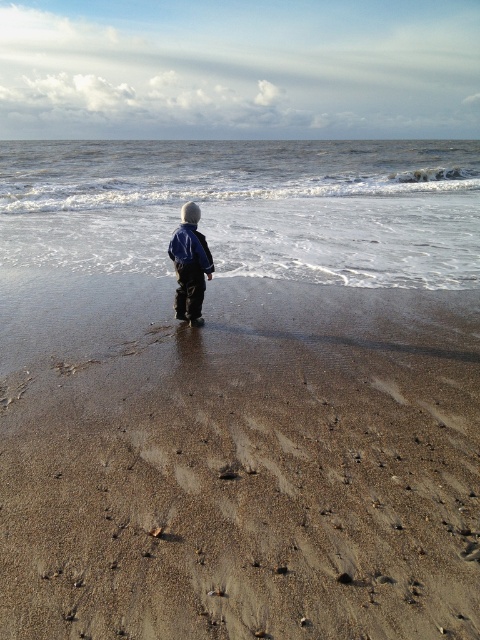
Question: Which is nearer to the white frothy water at center?

Choices:
 (A) blue denim jacket at center
 (B) brown sandy beach at center

Answer: (A)

Question: Considering the relative positions of brown sandy beach at center and white frothy water at center in the image provided, where is brown sandy beach at center located with respect to white frothy water at center?

Choices:
 (A) above
 (B) below

Answer: (B)

Question: Which object is farther from the camera taking this photo?

Choices:
 (A) brown sandy beach at center
 (B) white frothy water at center
 (C) blue denim jacket at center

Answer: (B)

Question: Is brown sandy beach at center above blue denim jacket at center?

Choices:
 (A) no
 (B) yes

Answer: (A)

Question: Considering the real-world distances, which object is farthest from the brown sandy beach at center?

Choices:
 (A) blue denim jacket at center
 (B) white frothy water at center

Answer: (B)

Question: Is white frothy water at center in front of blue denim jacket at center?

Choices:
 (A) no
 (B) yes

Answer: (A)